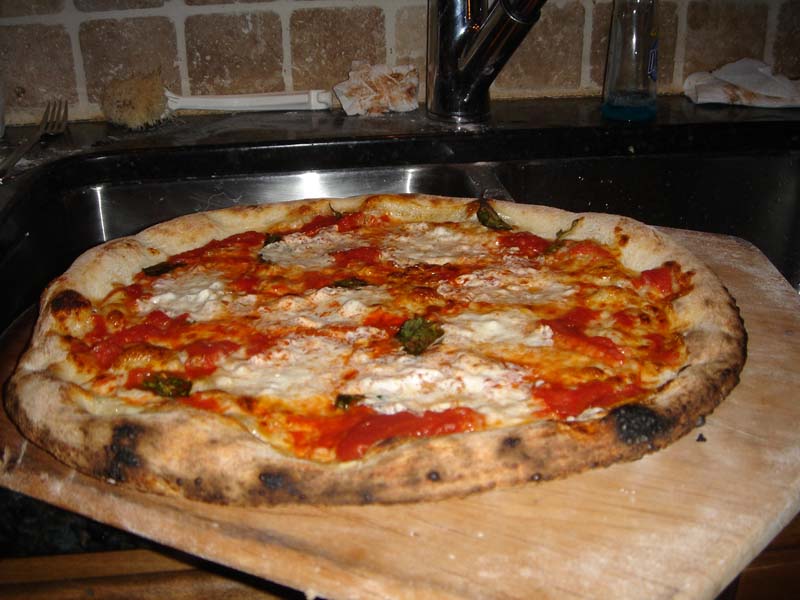
The height and width of the screenshot is (600, 800). What are the coordinates of `fork place with the prongs where you eat from` in the screenshot? It's located at (58, 116).